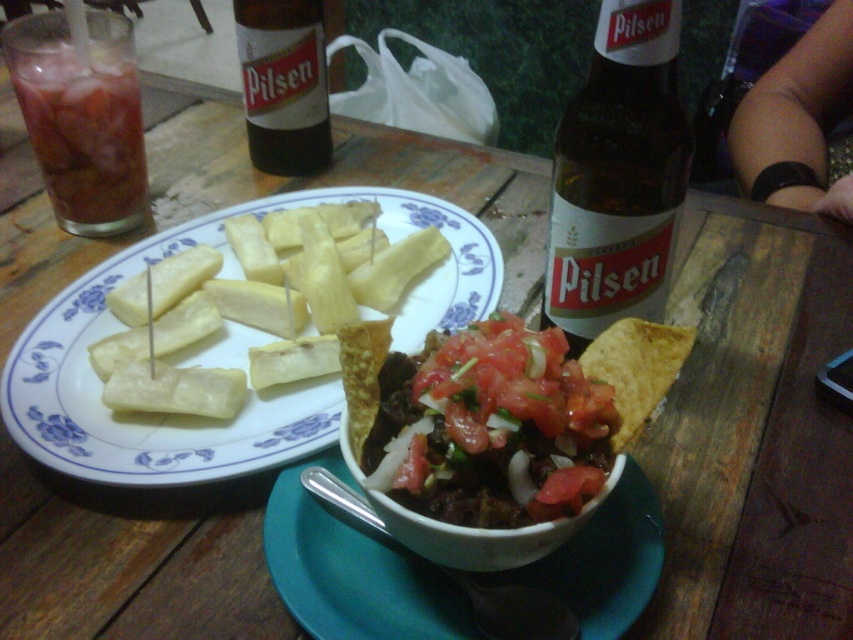
You are a customer at the restaurant and want to reach for the brown glass bottle at upper center to pour some drink into your glass. However, there are yellow rubbery plantains at center in the way. Based on their positions, can you move the plantains to the side to access the bottle?

The yellow rubbery plantains at center are to the right of the brown glass bottle at upper center, so you can move them to the left or right to access the bottle.

You are a server at the restaurant and need to pour a drink from the translucent glass bottle at upper center into the translucent glass with ice at upper left. Is the glass big enough to hold the contents of the bottle without spilling?

The translucent glass bottle at upper center is bigger than the translucent glass with ice at upper left, so pouring the contents might cause overflow and spillage. Check the capacity or use a larger glass.

You are a waiter in a restaurant. You need to place a new order of drinks on the table. The new drinks are in a tray that is 15 inches wide. Can you fit both the translucent glass bottle at upper center and the translucent glass with ice at upper left onto the tray without overlapping them?

The distance between the translucent glass bottle at upper center and the translucent glass with ice at upper left is 14.88 inches. Since the tray is 15 inches wide, there is enough space to fit both items without overlapping.